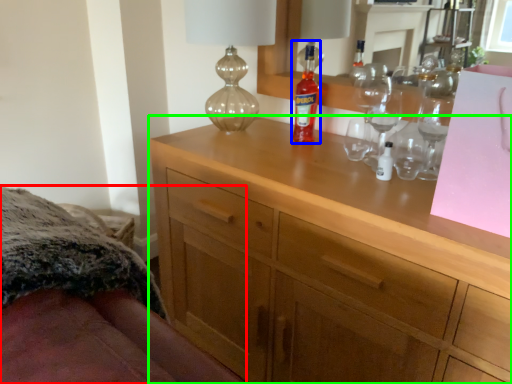
Question: Which is nearer to the bed (highlighted by a red box)? bottle (highlighted by a blue box) or chest of drawers (highlighted by a green box).

Choices:
 (A) bottle
 (B) chest of drawers

Answer: (B)